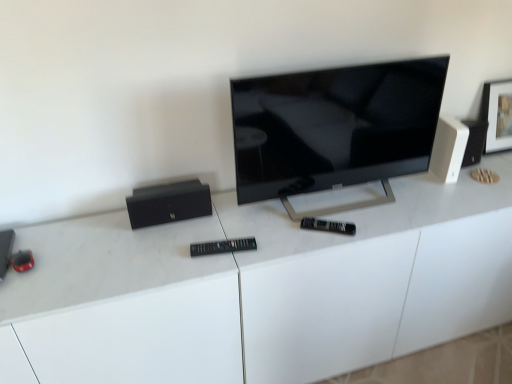
The image size is (512, 384). In order to click on free space to the left of black matte speaker at left, acting as the 2th speaker starting from the top in this screenshot , I will do `click(104, 234)`.